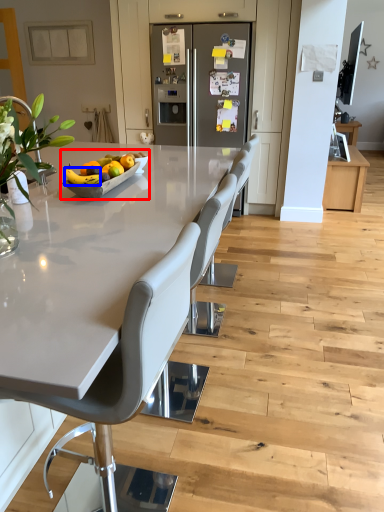
Question: Among these objects, which one is farthest to the camera, fruit dish (highlighted by a red box) or fruit (highlighted by a blue box)?

Choices:
 (A) fruit dish
 (B) fruit

Answer: (A)